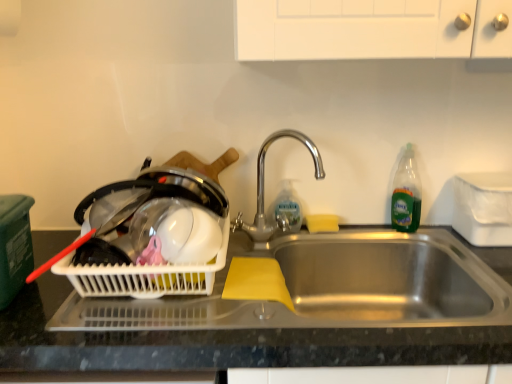
This screenshot has width=512, height=384. What are the coordinates of `free space to the right of yellow sponge at sink` in the screenshot? It's located at click(x=366, y=231).